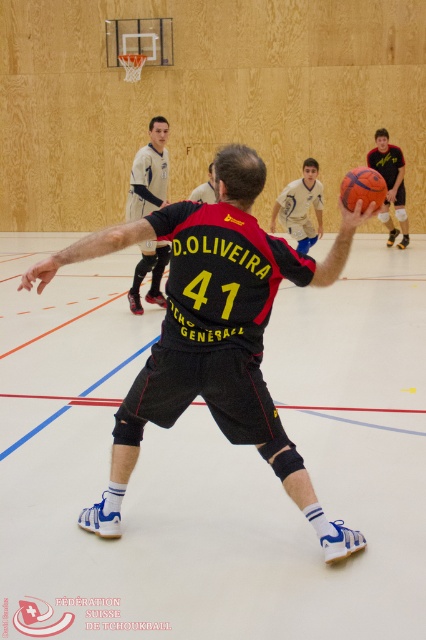
Based on the scene description, where is the black matte jersey at center located in terms of coordinates?

The black matte jersey at center is located at coordinates point (213, 332).

You are a referee in the gymnasium observing the indoor tchoukball game. You notice a blue jersey at center and a glossy orange basketball at center. Which object is wider?

The blue jersey at center is wider than the glossy orange basketball at center.

You are a referee in the gymnasium observing the indoor tchoukball game. You notice two players wearing the black matte jersey at center and the light blue jersey at center. Based on their jersey positions, which player do you think is closer to the basketball hoop mounted on the wooden wall in the background?

The black matte jersey at center is much taller than the light blue jersey at center, so the player wearing the black matte jersey at center is closer to the basketball hoop mounted on the wooden wall in the background.